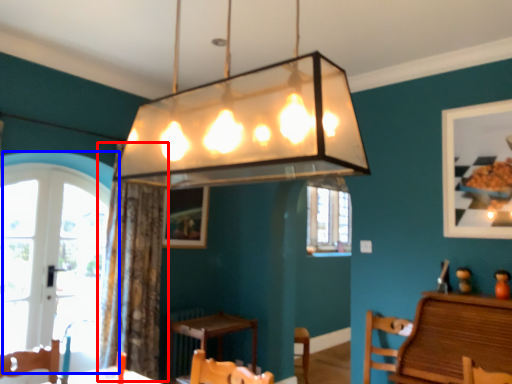
Question: Which of the following is the farthest to the observer, curtain (highlighted by a red box) or window (highlighted by a blue box)?

Choices:
 (A) curtain
 (B) window

Answer: (A)